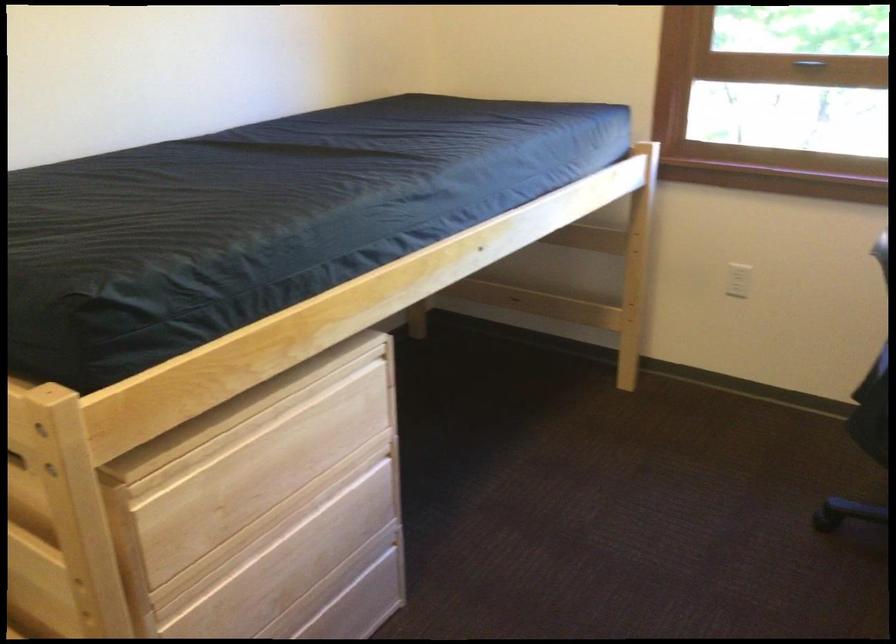
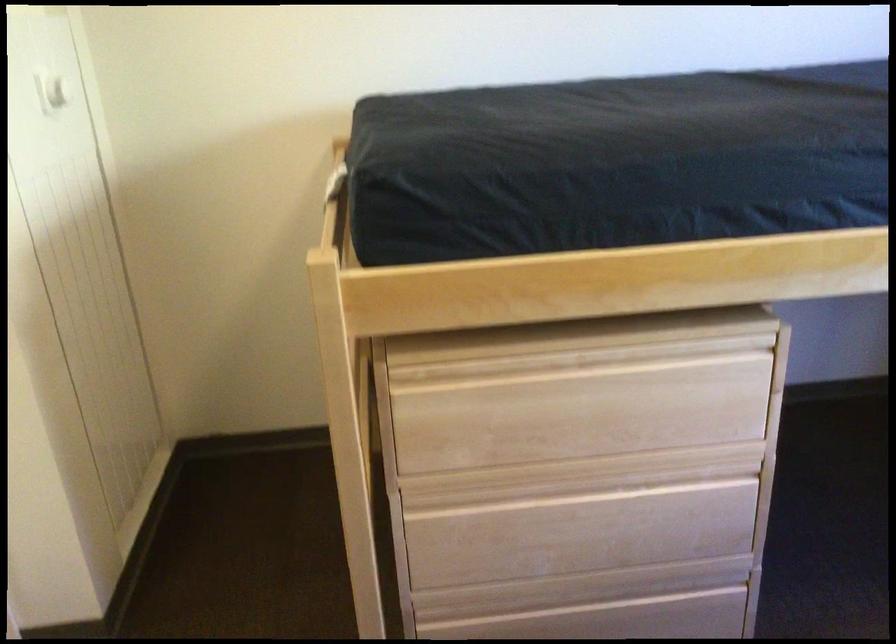
The point at (311, 415) is marked in the first image. Where is the corresponding point in the second image?

(642, 377)